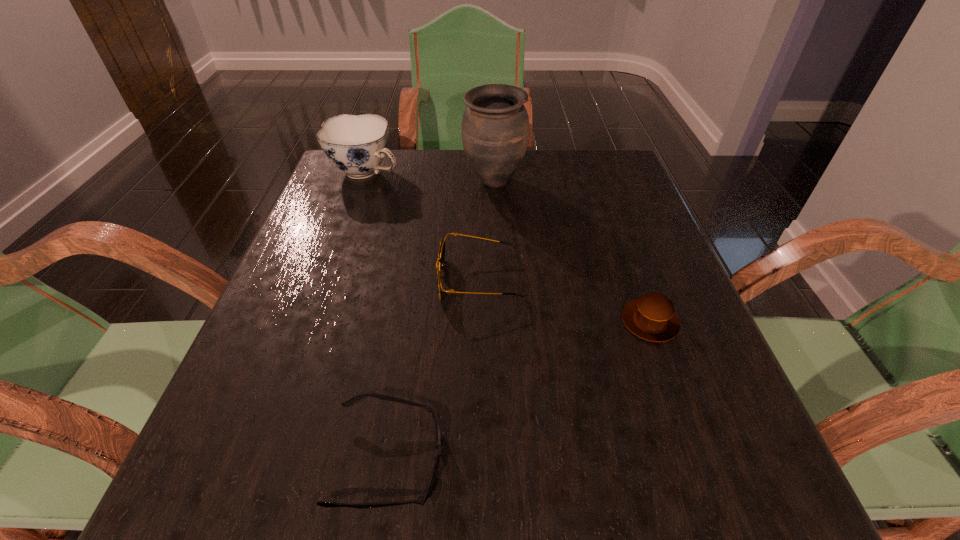
This screenshot has width=960, height=540. Identify the location of free space located on the front-facing side of the taller sunglasses. (396, 280).

The height and width of the screenshot is (540, 960). Find the location of `blank area located 0.400m on the back of the rightmost object`. blank area located 0.400m on the back of the rightmost object is located at coordinates (600, 182).

I want to click on free space located on the lenses of the nearest object, so click(x=495, y=460).

At what (x,y) coordinates should I click in order to perform the action: click on urn present at the far edge. Please return your answer as a coordinate pair (x, y). The image size is (960, 540). Looking at the image, I should click on click(x=495, y=127).

Locate an element on the screen. The width and height of the screenshot is (960, 540). chinaware present at the far edge is located at coordinates (356, 144).

Locate an element on the screen. object that is at the near edge is located at coordinates (421, 499).

The height and width of the screenshot is (540, 960). I want to click on object that is at the left edge, so click(x=356, y=144).

Where is `object present at the right edge`? object present at the right edge is located at coordinates (652, 317).

Find the location of `object present at the far left corner`. object present at the far left corner is located at coordinates (356, 144).

Identify the location of free space at the far edge. (537, 155).